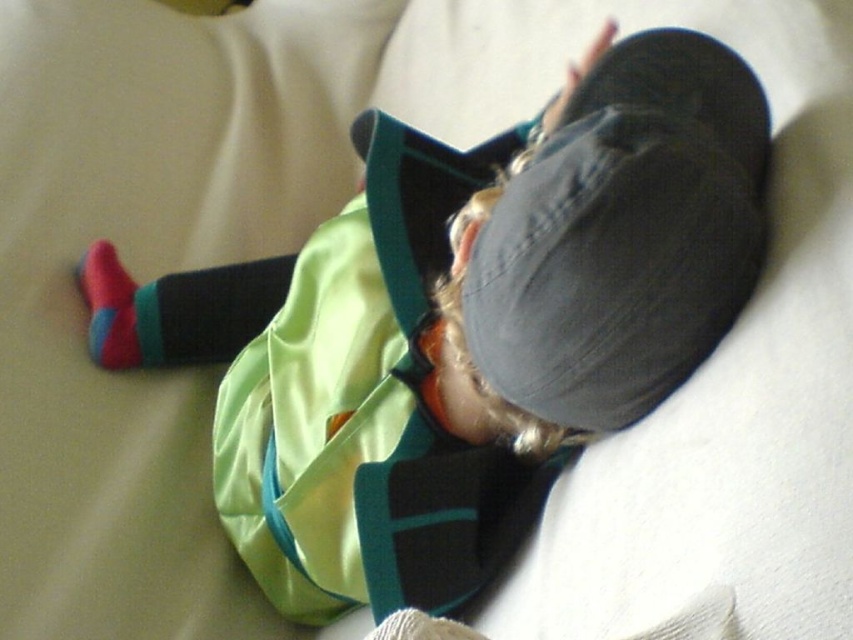
Is green fabric safety vest at center below red cotton sock at lower left?

Correct, green fabric safety vest at center is located below red cotton sock at lower left.

The height and width of the screenshot is (640, 853). I want to click on green fabric safety vest at center, so click(367, 404).

Locate an element on the screen. green fabric safety vest at center is located at coordinates (367, 404).